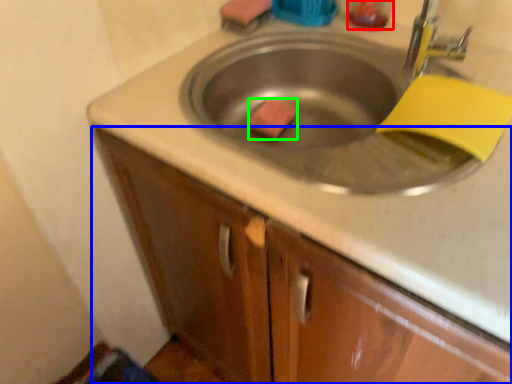
Question: Which is farther away from liquid (highlighted by a red box)? cabinetry (highlighted by a blue box) or soap (highlighted by a green box)?

Choices:
 (A) cabinetry
 (B) soap

Answer: (A)